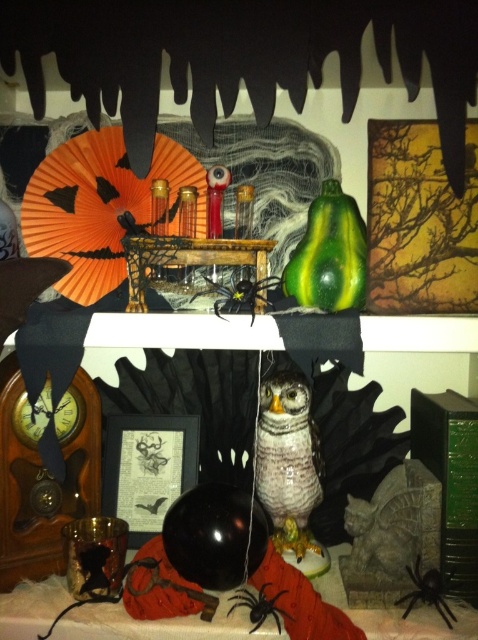
You are a child trying to reach for the speckled ceramic owl at center and the black fuzzy spider at lower right. Which one is closer to you?

The speckled ceramic owl at center is closer to you because the black fuzzy spider at lower right is behind it.

You are a toy mouse that is 3 inches long. You want to move from the speckled ceramic owl at center to the black fuzzy spider at lower right. Can you fit through the space between them without bending?

The distance between the speckled ceramic owl at center and the black fuzzy spider at lower right is 9.15 inches. Since the toy mouse is only 3 inches long, there is enough space for it to move through without needing to bend.

You are setting up a Halloween display and have a black matte balloon at lower center and a matte black frame at center. Which object is wider?

The black matte balloon at lower center is wider than the matte black frame at center.